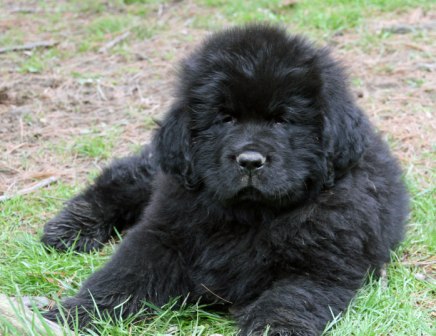
At what (x,y) coordinates should I click in order to perform the action: click on chest. Please return your answer as a coordinate pair (x, y). The height and width of the screenshot is (336, 436). Looking at the image, I should click on (253, 241).